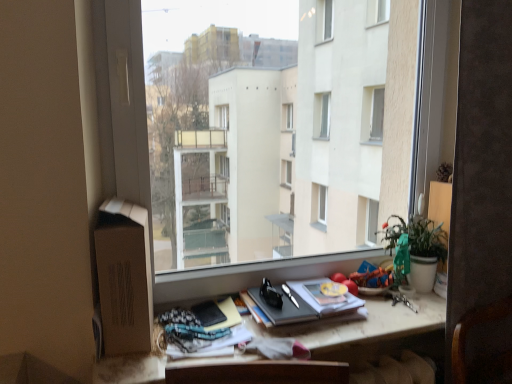
Identify the location of free space above matte wooden desk at center (from a real-world perspective). coord(304,326).